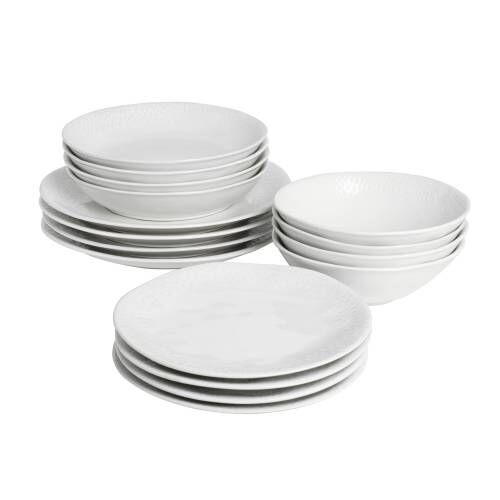
The height and width of the screenshot is (500, 500). Identify the location of bowls. (376, 277), (384, 263), (385, 251), (389, 240), (178, 166), (177, 177), (177, 189), (177, 202).